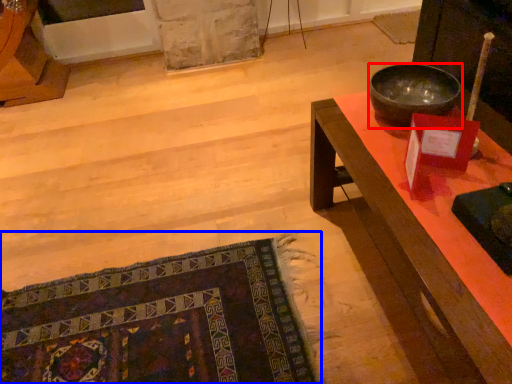
Question: Which point is closer to the camera, bowl (highlighted by a red box) or mat (highlighted by a blue box)?

Choices:
 (A) bowl
 (B) mat

Answer: (B)